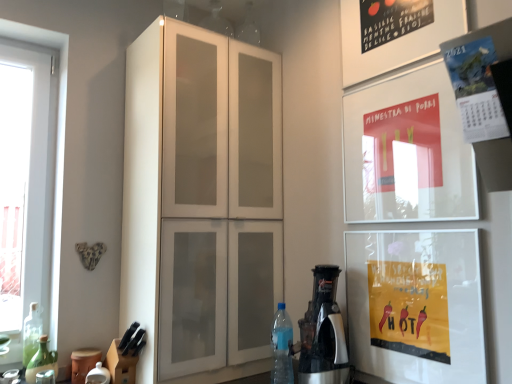
Question: Should I look upward or downward to see matte paper poster at upper right, which ranks as the second poster in front-to-back order?

Choices:
 (A) up
 (B) down

Answer: (A)

Question: Is silver metallic coffee machine at lower right thinner than blue translucent bottle at lower right, which appears as the 1th bottle when viewed from the right?

Choices:
 (A) no
 (B) yes

Answer: (A)

Question: Can you confirm if silver metallic coffee machine at lower right is taller than blue translucent bottle at lower right, the 3th bottle viewed from the left?

Choices:
 (A) no
 (B) yes

Answer: (B)

Question: Does silver metallic coffee machine at lower right lie in front of blue translucent bottle at lower right, which appears as the 1th bottle when viewed from the right?

Choices:
 (A) no
 (B) yes

Answer: (B)

Question: Does silver metallic coffee machine at lower right have a smaller size compared to blue translucent bottle at lower right, the 3th bottle viewed from the left?

Choices:
 (A) no
 (B) yes

Answer: (A)

Question: Is silver metallic coffee machine at lower right positioned beyond the bounds of blue translucent bottle at lower right, the 3th bottle viewed from the left?

Choices:
 (A) no
 (B) yes

Answer: (B)

Question: Is silver metallic coffee machine at lower right to the right of blue translucent bottle at lower right, the 3th bottle viewed from the left, from the viewer's perspective?

Choices:
 (A) no
 (B) yes

Answer: (B)

Question: Can you confirm if blue translucent bottle at lower right, which appears as the 1th bottle when viewed from the right, is wider than silver metallic coffee machine at lower right?

Choices:
 (A) yes
 (B) no

Answer: (B)

Question: From a real-world perspective, is blue translucent bottle at lower right, the 3th bottle viewed from the left, positioned under silver metallic coffee machine at lower right based on gravity?

Choices:
 (A) no
 (B) yes

Answer: (B)

Question: From the image's perspective, is blue translucent bottle at lower right, the 3th bottle viewed from the left, located beneath silver metallic coffee machine at lower right?

Choices:
 (A) no
 (B) yes

Answer: (B)

Question: Can you confirm if blue translucent bottle at lower right, which appears as the 1th bottle when viewed from the right, is positioned to the right of silver metallic coffee machine at lower right?

Choices:
 (A) no
 (B) yes

Answer: (A)

Question: Is blue translucent bottle at lower right, the 3th bottle viewed from the left, not inside silver metallic coffee machine at lower right?

Choices:
 (A) yes
 (B) no

Answer: (A)

Question: Does blue translucent bottle at lower right, which appears as the 1th bottle when viewed from the right, turn towards silver metallic coffee machine at lower right?

Choices:
 (A) no
 (B) yes

Answer: (A)

Question: Is green glass bottle at lower left, the first bottle positioned from the left, wider than silver metallic coffee machine at lower right?

Choices:
 (A) no
 (B) yes

Answer: (A)